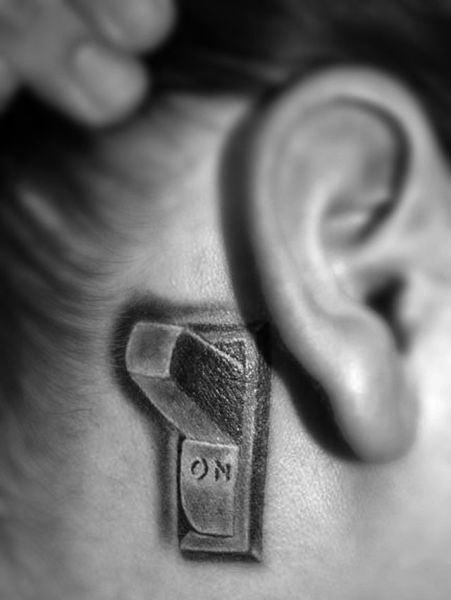
Find the location of `light switch`. light switch is located at coordinates (195, 391).